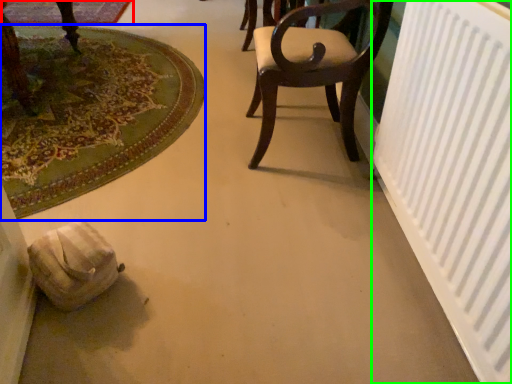
Question: Estimate the real-world distances between objects in this image. Which object is closer to mat (highlighted by a red box), mat (highlighted by a blue box) or radiator (highlighted by a green box)?

Choices:
 (A) mat
 (B) radiator

Answer: (A)